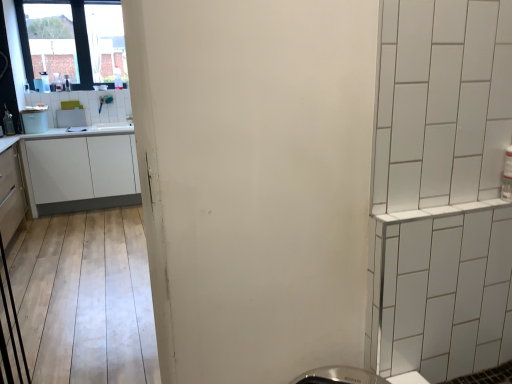
What do you see at coordinates (11, 194) in the screenshot?
I see `matte white cabinet at left, which is counted as the 2th cabinetry, starting from the back` at bounding box center [11, 194].

What are the coordinates of `white matte cabinet at left, the second cabinetry viewed from the front` in the screenshot? It's located at (82, 168).

Measure the distance between point [117,195] and camera.

4.86 meters.

Identify the location of white glossy trash can at left, which appears as the first appliance when viewed from the front. (34, 121).

You are a GUI agent. You are given a task and a screenshot of the screen. Output one action in this format:
    pyautogui.click(x=<x>, y=<y>)
    Task: Click on the transparent glass window at upper left
    This screenshot has width=512, height=384.
    Given the screenshot: What is the action you would take?
    click(75, 40)

What do you see at coordinates (71, 118) in the screenshot? I see `white glossy microwave at upper left, which is counted as the 1th appliance, starting from the back` at bounding box center [71, 118].

Find the location of a particular element. matte white cabinet at left, which is counted as the 2th cabinetry, starting from the back is located at coordinates (11, 194).

Is transparent glass window at upper left closer to the viewer compared to white matte cabinet at left, the second cabinetry viewed from the front?

No, it is behind white matte cabinet at left, the second cabinetry viewed from the front.

From the image's perspective, is transparent glass window at upper left located above white matte cabinet at left, the second cabinetry viewed from the front?

Yes, from the image's perspective, transparent glass window at upper left is on top of white matte cabinet at left, the second cabinetry viewed from the front.

Which of these two, transparent glass window at upper left or white matte cabinet at left, positioned as the 1th cabinetry in back-to-front order, stands shorter?

Standing shorter between the two is white matte cabinet at left, positioned as the 1th cabinetry in back-to-front order.

Does point (85, 44) come in front of point (65, 141)?

No.

From the image's perspective, which object appears higher, white glossy trash can at left, which appears as the first appliance when viewed from the front, or transparent glass window at upper left?

transparent glass window at upper left, from the image's perspective.

Is transparent glass window at upper left at the back of white glossy trash can at left, the 2th appliance in the back-to-front sequence?

No, white glossy trash can at left, the 2th appliance in the back-to-front sequence, is not facing away from transparent glass window at upper left.

In terms of size, does white glossy trash can at left, the 2th appliance in the back-to-front sequence, appear bigger or smaller than transparent glass window at upper left?

Considering their sizes, white glossy trash can at left, the 2th appliance in the back-to-front sequence, takes up less space than transparent glass window at upper left.

Between white glossy trash can at left, which appears as the first appliance when viewed from the front, and white glossy microwave at upper left, which ranks as the 2th appliance in front-to-back order, which one appears on the right side from the viewer's perspective?

From the viewer's perspective, white glossy microwave at upper left, which ranks as the 2th appliance in front-to-back order, appears more on the right side.

How different are the orientations of white glossy trash can at left, which appears as the first appliance when viewed from the front, and white glossy microwave at upper left, which ranks as the 2th appliance in front-to-back order, in degrees?

white glossy trash can at left, which appears as the first appliance when viewed from the front, and white glossy microwave at upper left, which ranks as the 2th appliance in front-to-back order, are facing 0.00132 degrees away from each other.

Considering the relative sizes of white glossy trash can at left, the 2th appliance in the back-to-front sequence, and white glossy microwave at upper left, which is counted as the 1th appliance, starting from the back, in the image provided, is white glossy trash can at left, the 2th appliance in the back-to-front sequence, taller than white glossy microwave at upper left, which is counted as the 1th appliance, starting from the back,?

Correct, white glossy trash can at left, the 2th appliance in the back-to-front sequence, is much taller as white glossy microwave at upper left, which is counted as the 1th appliance, starting from the back.

In terms of size, does white glossy trash can at left, which appears as the first appliance when viewed from the front, appear bigger or smaller than white glossy microwave at upper left, which ranks as the 2th appliance in front-to-back order?

In the image, white glossy trash can at left, which appears as the first appliance when viewed from the front, appears to be larger than white glossy microwave at upper left, which ranks as the 2th appliance in front-to-back order.

From a real-world perspective, who is located higher, white matte cabinet at left, the second cabinetry viewed from the front, or matte white cabinet at left, the 1th cabinetry viewed from the front?

matte white cabinet at left, the 1th cabinetry viewed from the front.

How different are the orientations of white matte cabinet at left, the second cabinetry viewed from the front, and matte white cabinet at left, which is counted as the 2th cabinetry, starting from the back, in degrees?

They differ by 90 degrees in their facing directions.

Is white matte cabinet at left, the second cabinetry viewed from the front, positioned with its back to matte white cabinet at left, the 1th cabinetry viewed from the front?

No, white matte cabinet at left, the second cabinetry viewed from the front, is not facing away from matte white cabinet at left, the 1th cabinetry viewed from the front.

Does white matte cabinet at left, positioned as the 1th cabinetry in back-to-front order, have a lesser width compared to matte white cabinet at left, which is counted as the 2th cabinetry, starting from the back?

No.

Locate an element on the screen. appliance lying on the left of matte white cabinet at left, the 1th cabinetry viewed from the front is located at coordinates (34, 121).

From the image's perspective, is white glossy trash can at left, the 2th appliance in the back-to-front sequence, located above matte white cabinet at left, which is counted as the 2th cabinetry, starting from the back?

Yes.

From the picture: Is white glossy trash can at left, the 2th appliance in the back-to-front sequence, in front of or behind matte white cabinet at left, which is counted as the 2th cabinetry, starting from the back, in the image?

In the image, white glossy trash can at left, the 2th appliance in the back-to-front sequence, appears behind matte white cabinet at left, which is counted as the 2th cabinetry, starting from the back.

Is white glossy trash can at left, which appears as the first appliance when viewed from the front, to the left or to the right of matte white cabinet at left, which is counted as the 2th cabinetry, starting from the back, in the image?

white glossy trash can at left, which appears as the first appliance when viewed from the front, is to the left of matte white cabinet at left, which is counted as the 2th cabinetry, starting from the back.

Considering the relative sizes of matte white cabinet at left, which is counted as the 2th cabinetry, starting from the back, and transparent glass window at upper left in the image provided, is matte white cabinet at left, which is counted as the 2th cabinetry, starting from the back, smaller than transparent glass window at upper left?

Incorrect, matte white cabinet at left, which is counted as the 2th cabinetry, starting from the back, is not smaller in size than transparent glass window at upper left.

From the image's perspective, is matte white cabinet at left, the 1th cabinetry viewed from the front, over transparent glass window at upper left?

No, from the image's perspective, matte white cabinet at left, the 1th cabinetry viewed from the front, is not on top of transparent glass window at upper left.

Considering the sizes of objects matte white cabinet at left, which is counted as the 2th cabinetry, starting from the back, and transparent glass window at upper left in the image provided, who is shorter, matte white cabinet at left, which is counted as the 2th cabinetry, starting from the back, or transparent glass window at upper left?

Standing shorter between the two is matte white cabinet at left, which is counted as the 2th cabinetry, starting from the back.

Is matte white cabinet at left, the 1th cabinetry viewed from the front, looking in the opposite direction of transparent glass window at upper left?

No.

Considering the sizes of objects white matte cabinet at left, positioned as the 1th cabinetry in back-to-front order, and transparent glass window at upper left in the image provided, who is bigger, white matte cabinet at left, positioned as the 1th cabinetry in back-to-front order, or transparent glass window at upper left?

With larger size is white matte cabinet at left, positioned as the 1th cabinetry in back-to-front order.

Can you confirm if white matte cabinet at left, the second cabinetry viewed from the front, is positioned to the left of transparent glass window at upper left?

No, white matte cabinet at left, the second cabinetry viewed from the front, is not to the left of transparent glass window at upper left.

Considering the positions of points (42, 197) and (41, 22), is point (42, 197) closer to camera compared to point (41, 22)?

Yes.

Is white matte cabinet at left, positioned as the 1th cabinetry in back-to-front order, facing towards transparent glass window at upper left?

No.

Locate an element on the screen. cabinetry that is the 1st one when counting forward from the transparent glass window at upper left is located at coordinates tap(82, 168).

Identify the location of window located above the white glossy trash can at left, which appears as the first appliance when viewed from the front (from a real-world perspective). (75, 40).

Looking at this image, based on their spatial positions, is white matte cabinet at left, the second cabinetry viewed from the front, or transparent glass window at upper left further from matte white cabinet at left, which is counted as the 2th cabinetry, starting from the back?

transparent glass window at upper left is further to matte white cabinet at left, which is counted as the 2th cabinetry, starting from the back.

Which object lies nearer to the anchor point white glossy microwave at upper left, which ranks as the 2th appliance in front-to-back order, transparent glass window at upper left or matte white cabinet at left, which is counted as the 2th cabinetry, starting from the back?

The object closer to white glossy microwave at upper left, which ranks as the 2th appliance in front-to-back order, is transparent glass window at upper left.

Based on their spatial positions, is white glossy microwave at upper left, which ranks as the 2th appliance in front-to-back order, or transparent glass window at upper left further from matte white cabinet at left, which is counted as the 2th cabinetry, starting from the back?

The object further to matte white cabinet at left, which is counted as the 2th cabinetry, starting from the back, is transparent glass window at upper left.

Looking at the image, which one is located further to white glossy microwave at upper left, which is counted as the 1th appliance, starting from the back, white glossy trash can at left, the 2th appliance in the back-to-front sequence, or transparent glass window at upper left?

transparent glass window at upper left is further to white glossy microwave at upper left, which is counted as the 1th appliance, starting from the back.

Looking at the image, which one is located closer to white glossy microwave at upper left, which ranks as the 2th appliance in front-to-back order, matte white cabinet at left, the 1th cabinetry viewed from the front, or white matte cabinet at left, the second cabinetry viewed from the front?

white matte cabinet at left, the second cabinetry viewed from the front, lies closer to white glossy microwave at upper left, which ranks as the 2th appliance in front-to-back order, than the other object.

Based on their spatial positions, is white matte cabinet at left, positioned as the 1th cabinetry in back-to-front order, or white glossy microwave at upper left, which is counted as the 1th appliance, starting from the back, further from matte white cabinet at left, which is counted as the 2th cabinetry, starting from the back?

white glossy microwave at upper left, which is counted as the 1th appliance, starting from the back, lies further to matte white cabinet at left, which is counted as the 2th cabinetry, starting from the back, than the other object.

Which object lies further to the anchor point matte white cabinet at left, the 1th cabinetry viewed from the front, white matte cabinet at left, positioned as the 1th cabinetry in back-to-front order, or white glossy trash can at left, the 2th appliance in the back-to-front sequence?

Among the two, white glossy trash can at left, the 2th appliance in the back-to-front sequence, is located further to matte white cabinet at left, the 1th cabinetry viewed from the front.

From the image, which object appears to be farther from white glossy trash can at left, which appears as the first appliance when viewed from the front, white matte cabinet at left, positioned as the 1th cabinetry in back-to-front order, or white glossy microwave at upper left, which ranks as the 2th appliance in front-to-back order?

white matte cabinet at left, positioned as the 1th cabinetry in back-to-front order, is positioned further to the anchor white glossy trash can at left, which appears as the first appliance when viewed from the front.

Image resolution: width=512 pixels, height=384 pixels. Identify the location of appliance between white glossy microwave at upper left, which is counted as the 1th appliance, starting from the back, and white matte cabinet at left, positioned as the 1th cabinetry in back-to-front order, vertically. (34, 121).

Locate an element on the screen. The height and width of the screenshot is (384, 512). appliance between matte white cabinet at left, which is counted as the 2th cabinetry, starting from the back, and white glossy microwave at upper left, which is counted as the 1th appliance, starting from the back, from front to back is located at coordinates (34, 121).

Locate an element on the screen. The image size is (512, 384). cabinetry located between matte white cabinet at left, the 1th cabinetry viewed from the front, and white glossy trash can at left, the 2th appliance in the back-to-front sequence, in the depth direction is located at coordinates (82, 168).

Identify the location of cabinetry between transparent glass window at upper left and matte white cabinet at left, which is counted as the 2th cabinetry, starting from the back, from top to bottom. Image resolution: width=512 pixels, height=384 pixels. (82, 168).